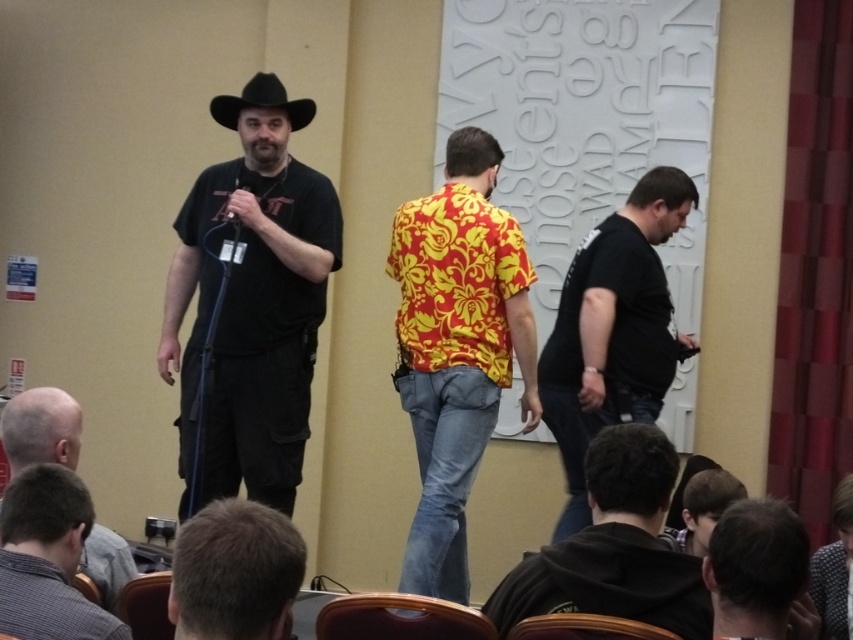
Question: Which point is farther from the camera taking this photo?

Choices:
 (A) (790, 586)
 (B) (281, 372)
 (C) (529, 632)

Answer: (B)

Question: Observing the image, what is the correct spatial positioning of floral print shirt at center in reference to bald head at lower left?

Choices:
 (A) right
 (B) left

Answer: (A)

Question: Which object is the closest to the dark brown hair at lower right?

Choices:
 (A) matte black shirt at center
 (B) floral print shirt at center

Answer: (B)

Question: Estimate the real-world distances between objects in this image. Which object is closer to the matte black shirt at center?

Choices:
 (A) brown leather chair at lower left
 (B) black hoodie at lower center
 (C) black matte shirt at center
 (D) short hair at lower left

Answer: (C)

Question: Is short hair at lower left thinner than brown leather chair at lower left?

Choices:
 (A) no
 (B) yes

Answer: (A)

Question: Where is black matte shirt at center located in relation to black plastic microphone at center in the image?

Choices:
 (A) above
 (B) below

Answer: (B)